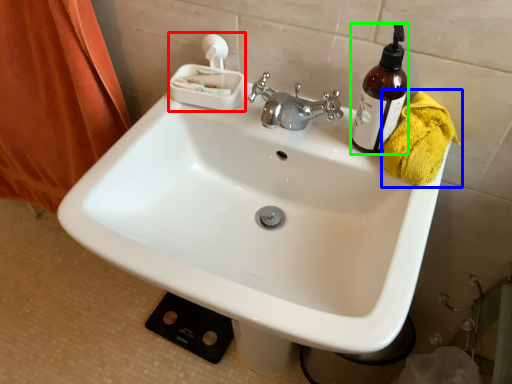
Question: Considering the real-world distances, which object is closest to tissue (highlighted by a red box)? bath towel (highlighted by a blue box) or bottle (highlighted by a green box).

Choices:
 (A) bath towel
 (B) bottle

Answer: (B)